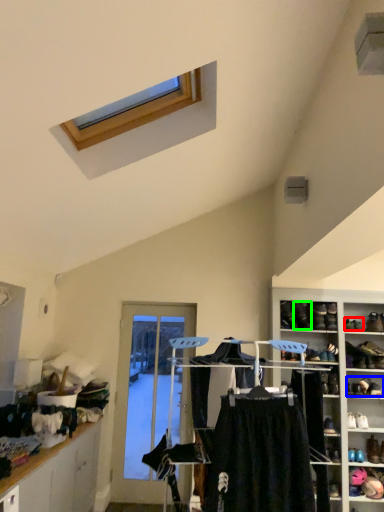
Question: Which is farther away from shoe (highlighted by a red box)? footwear (highlighted by a blue box) or shoe (highlighted by a green box)?

Choices:
 (A) footwear
 (B) shoe

Answer: (A)